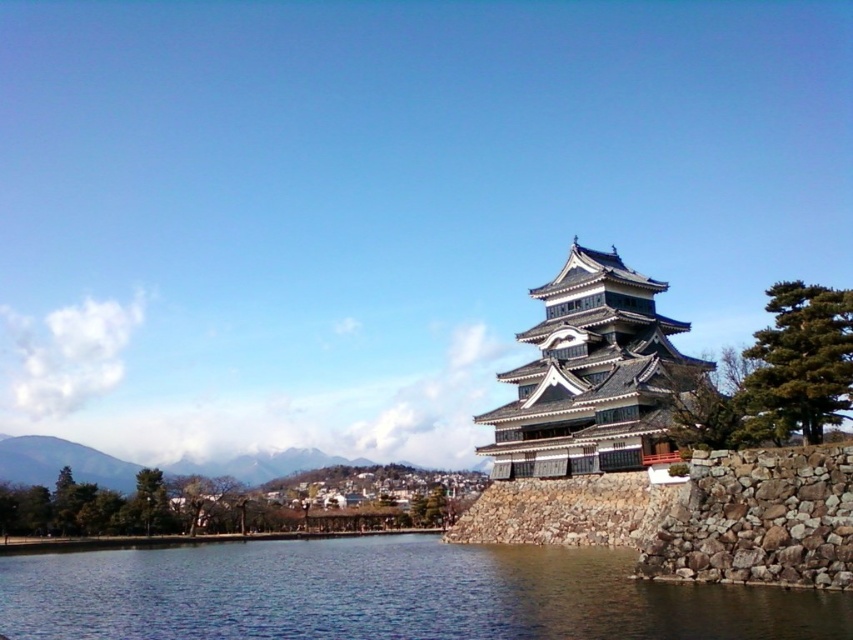
You are standing at the point marked by coordinates point (387, 595) in the image of Matsumoto Castle. Which direction should you walk to reach the blue water at lower left?

The blue water at lower left is represented by point (387, 595), so you are already at the blue water at lower left.

You are standing at the base of the gray stone tower at center and want to reach the blue water at lower left. Which direction should you walk to get there?

To reach the blue water at lower left from the gray stone tower at center, you should walk to the left since the blue water at lower left is positioned to the left of the gray stone tower at center.

You are standing at the base of the gray stone tower at center and want to reach the blue water at lower left. Which direction should you move to get there?

The blue water at lower left is positioned under the gray stone tower at center, so you should move downward or toward the lower part of the scene to reach it.